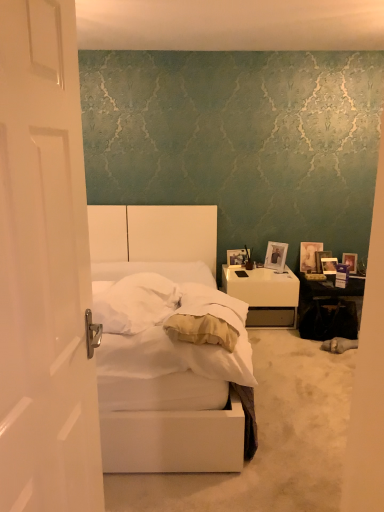
Question: Does wooden photo frame at right, acting as the 1th picture frame starting from the left, appear on the right side of metallic silver picture frame at upper right, positioned as the 2th picture frame in right-to-left order?

Choices:
 (A) no
 (B) yes

Answer: (A)

Question: Is wooden photo frame at right, acting as the 1th picture frame starting from the left, not inside metallic silver picture frame at upper right, which is the 4th picture frame in left-to-right order?

Choices:
 (A) yes
 (B) no

Answer: (A)

Question: From the image's perspective, does wooden photo frame at right, acting as the 1th picture frame starting from the left, appear higher than metallic silver picture frame at upper right, positioned as the 2th picture frame in right-to-left order?

Choices:
 (A) no
 (B) yes

Answer: (B)

Question: Considering the relative sizes of wooden photo frame at right, marked as the 5th picture frame in a right-to-left arrangement, and metallic silver picture frame at upper right, which is the 4th picture frame in left-to-right order, in the image provided, is wooden photo frame at right, marked as the 5th picture frame in a right-to-left arrangement, wider than metallic silver picture frame at upper right, which is the 4th picture frame in left-to-right order,?

Choices:
 (A) yes
 (B) no

Answer: (B)

Question: From a real-world perspective, is wooden photo frame at right, acting as the 1th picture frame starting from the left, below metallic silver picture frame at upper right, positioned as the 2th picture frame in right-to-left order?

Choices:
 (A) no
 (B) yes

Answer: (A)

Question: Considering the positions of point (246, 257) and point (271, 262), is point (246, 257) closer or farther from the camera than point (271, 262)?

Choices:
 (A) closer
 (B) farther

Answer: (A)

Question: Which is correct: wooden photo frame at right, marked as the 5th picture frame in a right-to-left arrangement, is inside matte silver picture frame at upper right, arranged as the second picture frame when viewed from the left, or outside of it?

Choices:
 (A) inside
 (B) outside

Answer: (B)

Question: From their relative heights in the image, would you say wooden photo frame at right, acting as the 1th picture frame starting from the left, is taller or shorter than matte silver picture frame at upper right, arranged as the second picture frame when viewed from the left?

Choices:
 (A) tall
 (B) short

Answer: (B)

Question: Considering the positions of wooden photo frame at right, acting as the 1th picture frame starting from the left, and matte silver picture frame at upper right, arranged as the second picture frame when viewed from the left, in the image, is wooden photo frame at right, acting as the 1th picture frame starting from the left, bigger or smaller than matte silver picture frame at upper right, arranged as the second picture frame when viewed from the left,?

Choices:
 (A) big
 (B) small

Answer: (B)

Question: Is point (289, 287) positioned closer to the camera than point (284, 253)?

Choices:
 (A) closer
 (B) farther

Answer: (A)

Question: In terms of height, does white glossy nightstand at right look taller or shorter compared to matte silver picture frame at upper right, arranged as the second picture frame when viewed from the left?

Choices:
 (A) tall
 (B) short

Answer: (A)

Question: Considering their positions, is white glossy nightstand at right located in front of or behind matte silver picture frame at upper right, the 4th picture frame from the right?

Choices:
 (A) behind
 (B) front

Answer: (B)

Question: Based on their positions, is white glossy nightstand at right located to the left or right of matte silver picture frame at upper right, arranged as the second picture frame when viewed from the left?

Choices:
 (A) left
 (B) right

Answer: (A)

Question: From a real-world perspective, relative to white glossy door at left, is matte purple picture frame at right, acting as the first picture frame starting from the right, vertically above or below?

Choices:
 (A) below
 (B) above

Answer: (A)

Question: In terms of width, does matte purple picture frame at right, which is the 5th picture frame in left-to-right order, look wider or thinner when compared to white glossy door at left?

Choices:
 (A) thin
 (B) wide

Answer: (A)